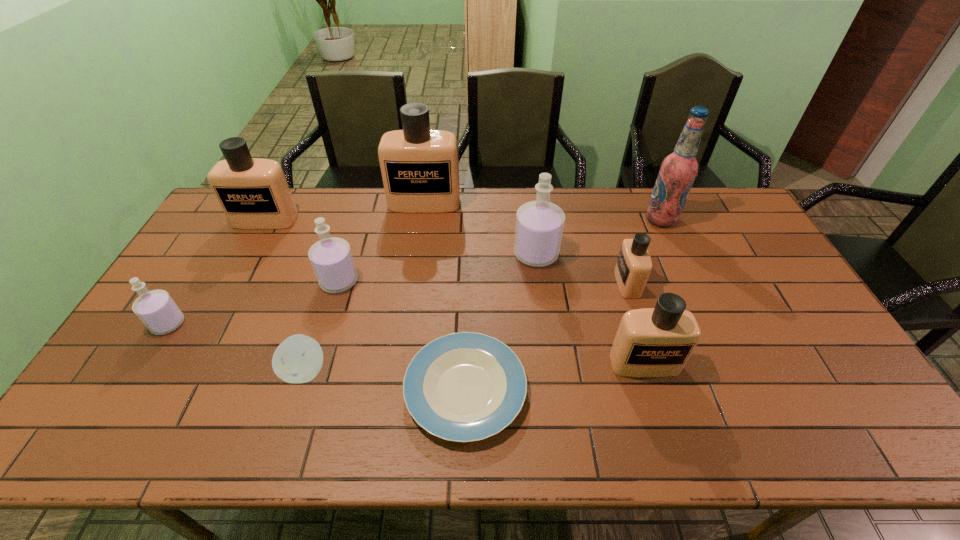
Find the location of a particular element. perfume that stands as the sixth closest to the second smallest beige perfume is located at coordinates (156, 309).

I want to click on beige perfume that stands as the closest to the fourth perfume from right to left, so click(253, 192).

Identify which beige perfume is the fourth nearest to the second smallest purple perfume. Please provide its 2D coordinates. Your answer should be formatted as a tuple, i.e. [(x, y)], where the tuple contains the x and y coordinates of a point satisfying the conditions above.

[(634, 264)]

Locate an element on the screen. The image size is (960, 540). purple perfume that is the second closest one to the alcohol is located at coordinates (331, 258).

Identify the location of the third closest purple perfume to the leftmost beige perfume. coord(539,224).

This screenshot has width=960, height=540. What are the coordinates of `free spot that satisfies the following two spatial constraints: 1. on the front label of the tallest perfume; 2. on the left side of the blue alcohol` in the screenshot? It's located at (422, 219).

Where is `blank area in the image that satisfies the following two spatial constraints: 1. on the front label of the blue alcohol; 2. on the right side of the third beige perfume from right to left`? This screenshot has width=960, height=540. blank area in the image that satisfies the following two spatial constraints: 1. on the front label of the blue alcohol; 2. on the right side of the third beige perfume from right to left is located at coordinates (x=422, y=219).